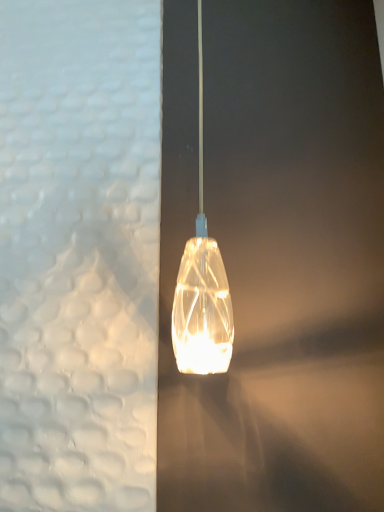
Locate an element on the screen. transparent glass pendant light at center is located at coordinates (202, 286).

What do you see at coordinates (202, 286) in the screenshot?
I see `transparent glass pendant light at center` at bounding box center [202, 286].

You are a GUI agent. You are given a task and a screenshot of the screen. Output one action in this format:
    pyautogui.click(x=<x>, y=<y>)
    Task: Click on the transparent glass pendant light at center
    
    Given the screenshot: What is the action you would take?
    pyautogui.click(x=202, y=286)